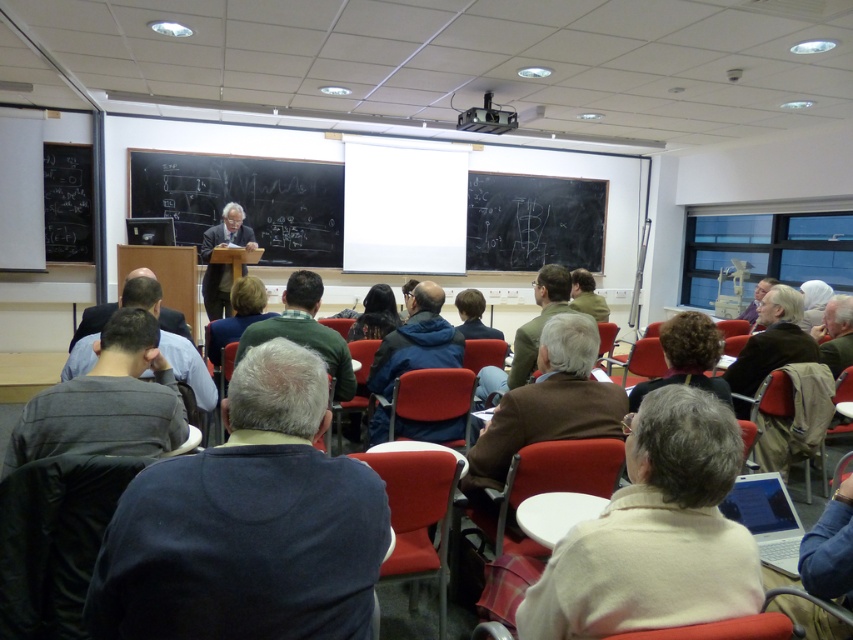
You are sitting in the classroom and want to see both the green matte sweater at center and the curly hair at center. Which one will appear closer to you?

The green matte sweater at center appears closer because it is further to the viewer than the curly hair at center.

Consider the image. You are a student sitting at the back row of the classroom. You want to hand a note to the person wearing the green matte sweater at center. Based on the coordinates provided, can you determine if you can reach them without leaving your seat?

The green matte sweater at center is located at coordinates point (305, 330). Since you are sitting in the back row, it is unlikely you can reach them without leaving your seat as the distance is too far.